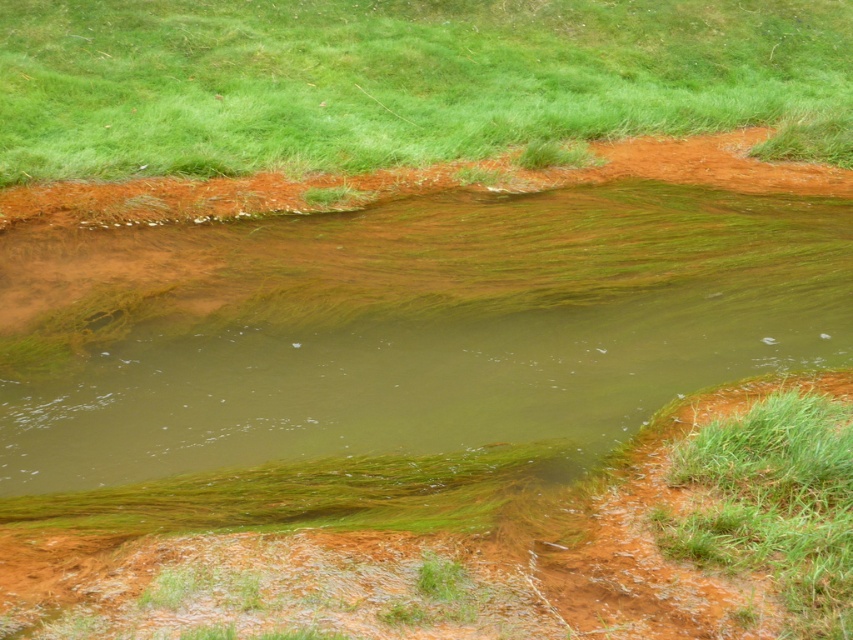
From the picture: Which is below, green grassy at upper center or green grassy at lower right?

green grassy at lower right is lower down.

Does point (78, 4) come in front of point (691, 524)?

No, it is not.

The width and height of the screenshot is (853, 640). In order to click on green grassy at upper center in this screenshot , I will do `click(403, 81)`.